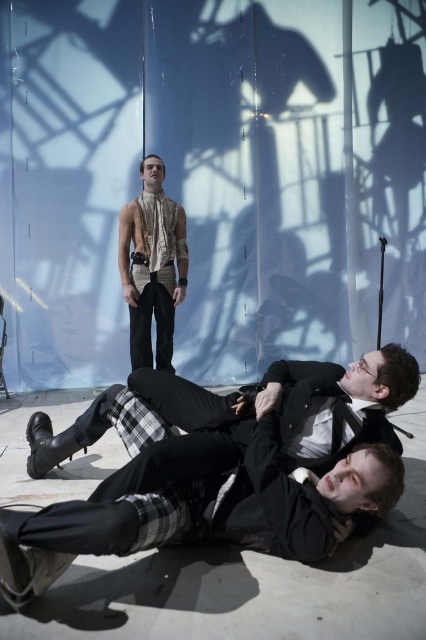
Question: Which object appears farthest from the camera in this image?

Choices:
 (A) matte black suit at lower center
 (B) plaid wool pants at lower center
 (C) matte beige shirt at center

Answer: (C)

Question: Can you confirm if matte black suit at lower center is positioned below plaid wool pants at lower center?

Choices:
 (A) no
 (B) yes

Answer: (B)

Question: Which of the following is the closest to the observer?

Choices:
 (A) (416, 362)
 (B) (166, 360)
 (C) (284, 461)

Answer: (A)

Question: Is plaid wool pants at lower center thinner than matte beige shirt at center?

Choices:
 (A) no
 (B) yes

Answer: (A)

Question: Is plaid wool pants at lower center above matte beige shirt at center?

Choices:
 (A) yes
 (B) no

Answer: (B)

Question: Which object appears farthest from the camera in this image?

Choices:
 (A) matte beige shirt at center
 (B) matte black suit at lower center
 (C) plaid wool pants at lower center

Answer: (A)